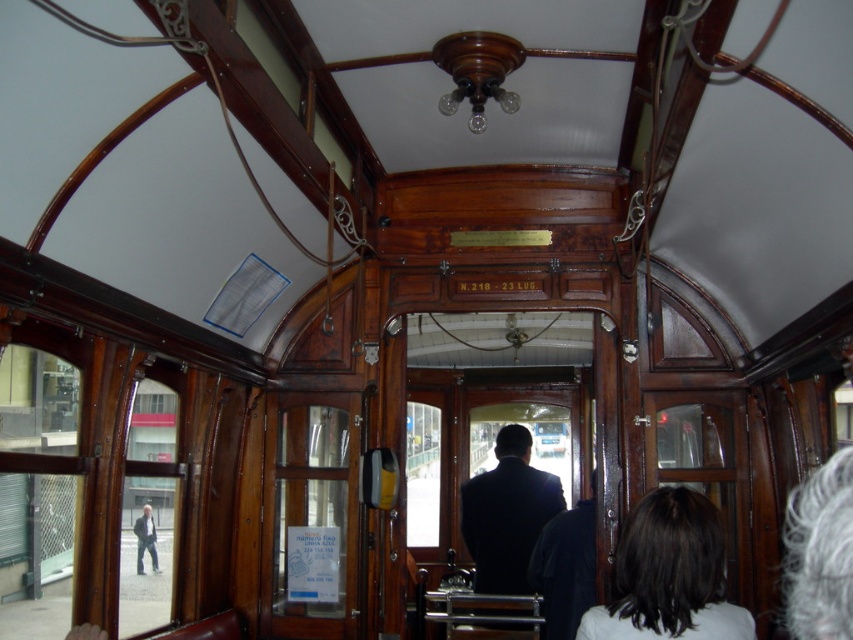
You are a passenger in the vintage tram and want to know if you can safely pass between the dark brown hair at lower right and the gray hair at upper right without touching either. Your body is 0.5 meters wide. Can you fit through the space between them?

The distance between the dark brown hair at lower right and gray hair at upper right is 1.35 meters. Since your body is only 0.5 meters wide, you have enough space to pass through safely without touching either.